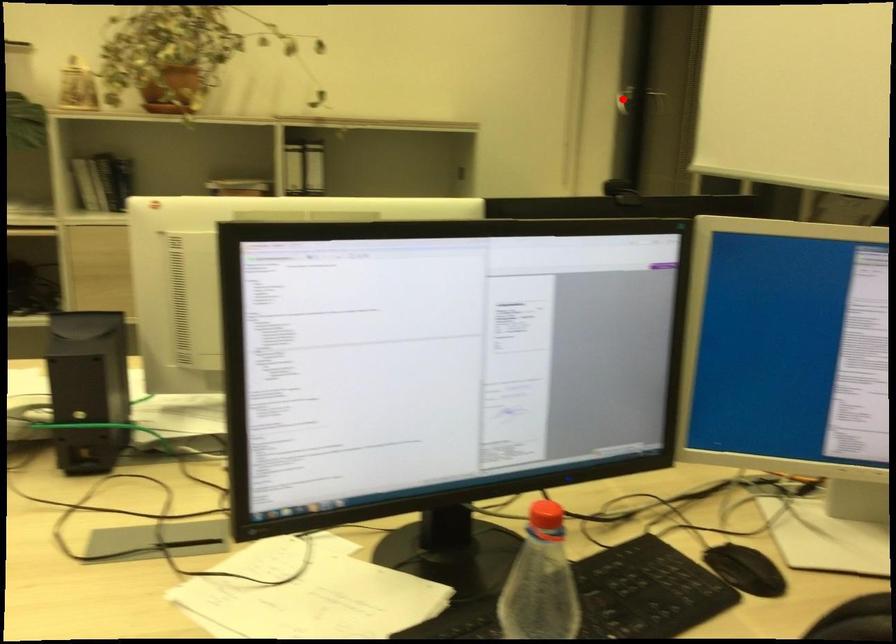
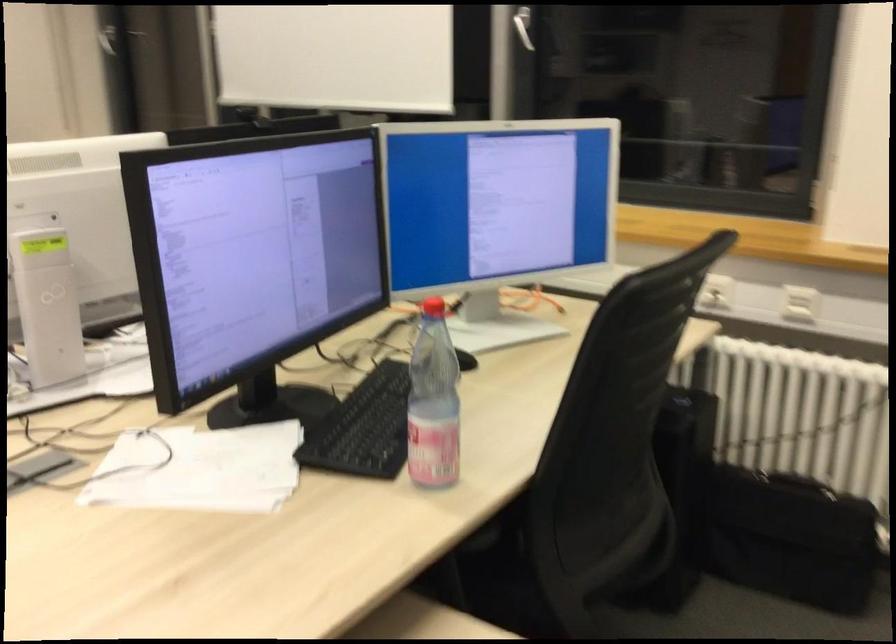
Locate, in the second image, the point that corresponds to the highlighted location in the first image.

(112, 33)